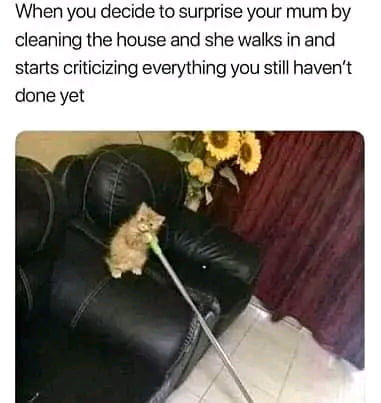
The width and height of the screenshot is (381, 403). I want to click on floor, so click(284, 368).